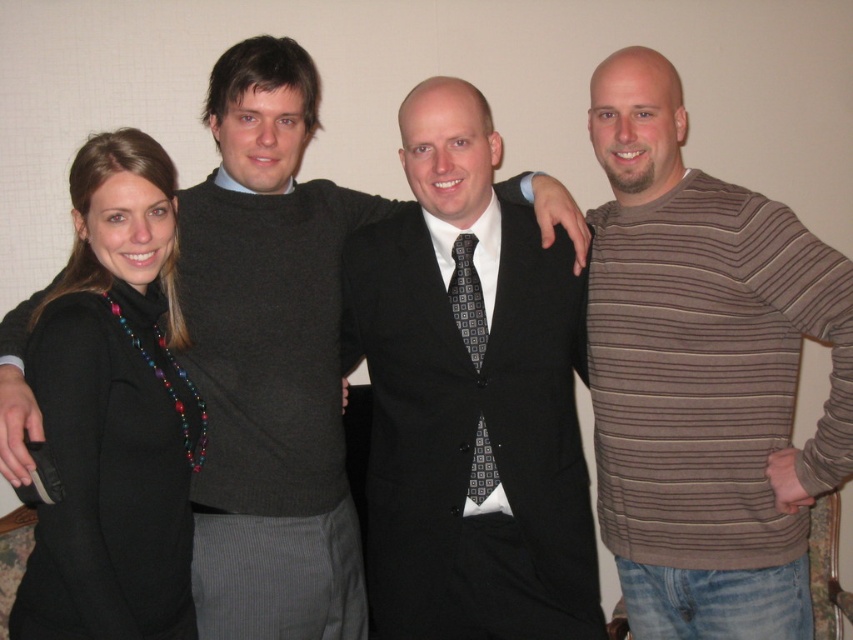
You are standing in front of the group photo and want to touch the brown striped sweater at right and the black sweater at left. Which one can you reach first without moving your position?

The brown striped sweater at right is closer to the viewer than the black sweater at left, so you can reach the brown striped sweater at right first without moving your position.

You are a photographer trying to adjust the lighting for a group photo. You notice the matte black suit at center and the black textured tie at center. Which of these two items might cast a longer shadow under the current lighting setup?

The matte black suit at center has a greater height compared to the black textured tie at center, so it would cast a longer shadow under the current lighting setup.

Based on the scene description, which object is positioned closer to the camera between the matte black suit at center and the black textured tie at center?

The matte black suit at center is positioned closer to the camera than the black textured tie at center.